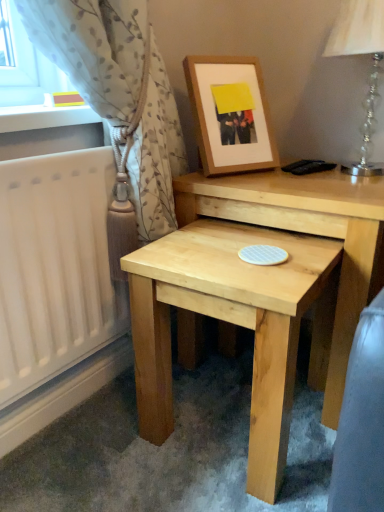
What is the approximate height of natural wood table at center, the 2th table in the front-to-back sequence?

The height of natural wood table at center, the 2th table in the front-to-back sequence, is 23.96 inches.

Find the location of a particular element. This screenshot has width=384, height=512. clear crystal glass table lamp at upper right is located at coordinates (360, 54).

What is the approximate height of clear crystal glass table lamp at upper right?

The height of clear crystal glass table lamp at upper right is 46.23 centimeters.

You are a GUI agent. You are given a task and a screenshot of the screen. Output one action in this format:
    pyautogui.click(x=<x>, y=<y>)
    Task: Click on the natural wood table at lower center, placed as the 2th table when sorted from back to front
    
    Given the screenshot: What is the action you would take?
    pyautogui.click(x=234, y=324)

Looking at this image, from a real-world perspective, is natural wood table at center, the first table from the back, above or below wooden frame at upper center?

natural wood table at center, the first table from the back, is situated lower than wooden frame at upper center in the real world.

Choose the correct answer: Is natural wood table at center, the 2th table in the front-to-back sequence, inside wooden frame at upper center or outside it?

The correct answer is: outside.

Is point (347, 183) in front of point (237, 77)?

Yes, it is in front of point (237, 77).

From the image's perspective, is natural wood table at center, the 2th table in the front-to-back sequence, located above or below wooden frame at upper center?

Clearly, from the image's perspective, natural wood table at center, the 2th table in the front-to-back sequence, is below wooden frame at upper center.

From a real-world perspective, relative to clear crystal glass table lamp at upper right, is light beige textured curtain at left vertically above or below?

In terms of real-world spatial position, light beige textured curtain at left is below clear crystal glass table lamp at upper right.

Is point (147, 134) behind point (383, 8)?

Yes, it is behind point (383, 8).

Is light beige textured curtain at left facing towards clear crystal glass table lamp at upper right?

No, light beige textured curtain at left is not turned towards clear crystal glass table lamp at upper right.

Is light beige textured curtain at left far from clear crystal glass table lamp at upper right?

light beige textured curtain at left is near clear crystal glass table lamp at upper right, not far away.

Is natural wood table at center, the 2th table in the front-to-back sequence, not close to light beige textured curtain at left?

They are positioned close to each other.

Which point is more forward, (264,176) or (40,24)?

The point (40,24) is in front.

Can we say natural wood table at center, the 2th table in the front-to-back sequence, lies outside light beige textured curtain at left?

Yes, natural wood table at center, the 2th table in the front-to-back sequence, is outside of light beige textured curtain at left.

Considering the relative positions of natural wood table at center, the first table from the back, and light beige textured curtain at left in the image provided, is natural wood table at center, the first table from the back, to the left or to the right of light beige textured curtain at left?

natural wood table at center, the first table from the back, is positioned on light beige textured curtain at left's right side.

Can you tell me how much clear crystal glass table lamp at upper right and wooden frame at upper center differ in facing direction?

57.2 degrees.

Is clear crystal glass table lamp at upper right not within wooden frame at upper center?

Yes, clear crystal glass table lamp at upper right is not within wooden frame at upper center.

Can you confirm if clear crystal glass table lamp at upper right is smaller than wooden frame at upper center?

No, clear crystal glass table lamp at upper right is not smaller than wooden frame at upper center.

Is wooden frame at upper center in front of or behind natural wood table at center, the first table from the back, in the image?

wooden frame at upper center is positioned farther from the viewer than natural wood table at center, the first table from the back.

From the image's perspective, is wooden frame at upper center above natural wood table at center, the 2th table in the front-to-back sequence?

Yes, from the image's perspective, wooden frame at upper center is on top of natural wood table at center, the 2th table in the front-to-back sequence.

What's the angular difference between wooden frame at upper center and natural wood table at center, the first table from the back,'s facing directions?

The angle between the facing direction of wooden frame at upper center and the facing direction of natural wood table at center, the first table from the back, is 60.2 degrees.

Can you confirm if wooden frame at upper center is thinner than natural wood table at center, the first table from the back?

Yes, wooden frame at upper center is thinner than natural wood table at center, the first table from the back.

From the image's perspective, is wooden frame at upper center over light beige textured curtain at left?

Yes, from the image's perspective, wooden frame at upper center is over light beige textured curtain at left.

Considering the sizes of objects wooden frame at upper center and light beige textured curtain at left in the image provided, who is wider, wooden frame at upper center or light beige textured curtain at left?

light beige textured curtain at left is wider.

Is point (191, 76) farther from viewer compared to point (136, 56)?

Yes.

Which point is more forward, (x=85, y=71) or (x=203, y=99)?

The point (x=85, y=71) is closer to the camera.

Can you confirm if light beige textured curtain at left is positioned to the right of wooden frame at upper center?

Incorrect, light beige textured curtain at left is not on the right side of wooden frame at upper center.

Is light beige textured curtain at left facing towards wooden frame at upper center?

No, light beige textured curtain at left does not turn towards wooden frame at upper center.

Is light beige textured curtain at left surrounding wooden frame at upper center?

That's incorrect, wooden frame at upper center is not inside light beige textured curtain at left.

Where is `table on the right of wooden frame at upper center`? The width and height of the screenshot is (384, 512). table on the right of wooden frame at upper center is located at coordinates (306, 233).

The width and height of the screenshot is (384, 512). In order to click on table lamp that appears above the light beige textured curtain at left (from the image's perspective) in this screenshot , I will do `click(360, 54)`.

Considering their positions, is natural wood table at lower center, placed as the 2th table when sorted from back to front, positioned closer to natural wood table at center, the first table from the back, than clear crystal glass table lamp at upper right?

natural wood table at lower center, placed as the 2th table when sorted from back to front, is closer to natural wood table at center, the first table from the back.

Considering their positions, is wooden frame at upper center positioned closer to clear crystal glass table lamp at upper right than light beige textured curtain at left?

Based on the image, wooden frame at upper center appears to be nearer to clear crystal glass table lamp at upper right.

Looking at the image, which one is located further to natural wood table at lower center, placed as the 2th table when sorted from back to front, natural wood table at center, the 2th table in the front-to-back sequence, or light beige textured curtain at left?

Based on the image, light beige textured curtain at left appears to be further to natural wood table at lower center, placed as the 2th table when sorted from back to front.

When comparing their distances from natural wood table at center, the first table from the back, does natural wood table at lower center, placed as the 2th table when sorted from back to front, or wooden frame at upper center seem closer?

Based on the image, natural wood table at lower center, placed as the 2th table when sorted from back to front, appears to be nearer to natural wood table at center, the first table from the back.

Which object lies further to the anchor point wooden frame at upper center, natural wood table at center, the first table from the back, or clear crystal glass table lamp at upper right?

The object further to wooden frame at upper center is clear crystal glass table lamp at upper right.

From the image, which object appears to be nearer to clear crystal glass table lamp at upper right, natural wood table at center, the first table from the back, or wooden frame at upper center?

wooden frame at upper center.

Looking at the image, which one is located closer to wooden frame at upper center, clear crystal glass table lamp at upper right or light beige textured curtain at left?

light beige textured curtain at left is positioned closer to the anchor wooden frame at upper center.

From the image, which object appears to be farther from wooden frame at upper center, natural wood table at center, the 2th table in the front-to-back sequence, or light beige textured curtain at left?

natural wood table at center, the 2th table in the front-to-back sequence, lies further to wooden frame at upper center than the other object.

This screenshot has width=384, height=512. Identify the location of picture frame between light beige textured curtain at left and clear crystal glass table lamp at upper right. tap(230, 114).

Find the location of a particular element. This screenshot has width=384, height=512. table between wooden frame at upper center and natural wood table at lower center, placed as the 2th table when sorted from back to front, from top to bottom is located at coordinates (306, 233).

Where is `curtain between wooden frame at upper center and natural wood table at lower center, placed as the 2th table when sorted from back to front, vertically`? The image size is (384, 512). curtain between wooden frame at upper center and natural wood table at lower center, placed as the 2th table when sorted from back to front, vertically is located at coordinates (94, 48).

The width and height of the screenshot is (384, 512). In order to click on table between clear crystal glass table lamp at upper right and natural wood table at lower center, the first table in the front-to-back sequence, vertically in this screenshot , I will do tap(306, 233).